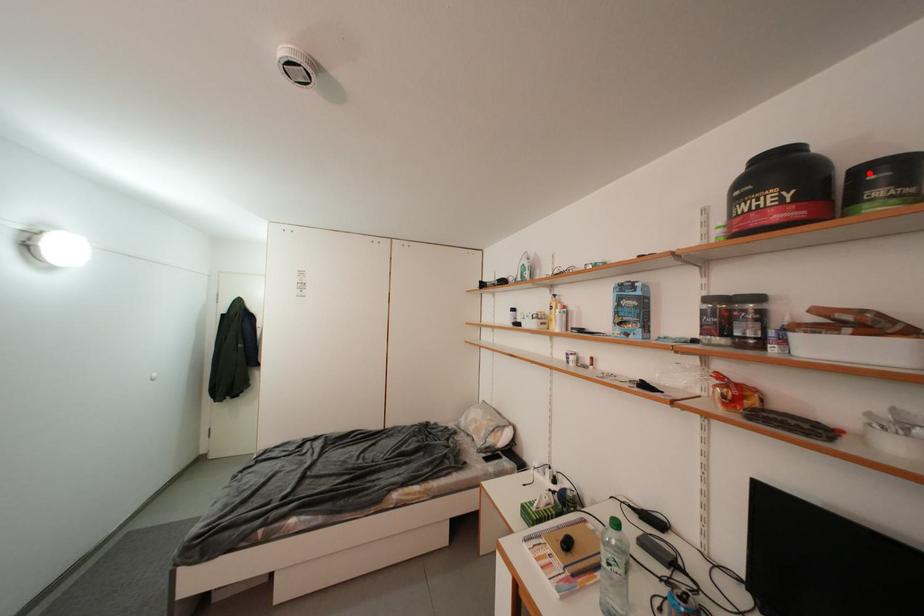
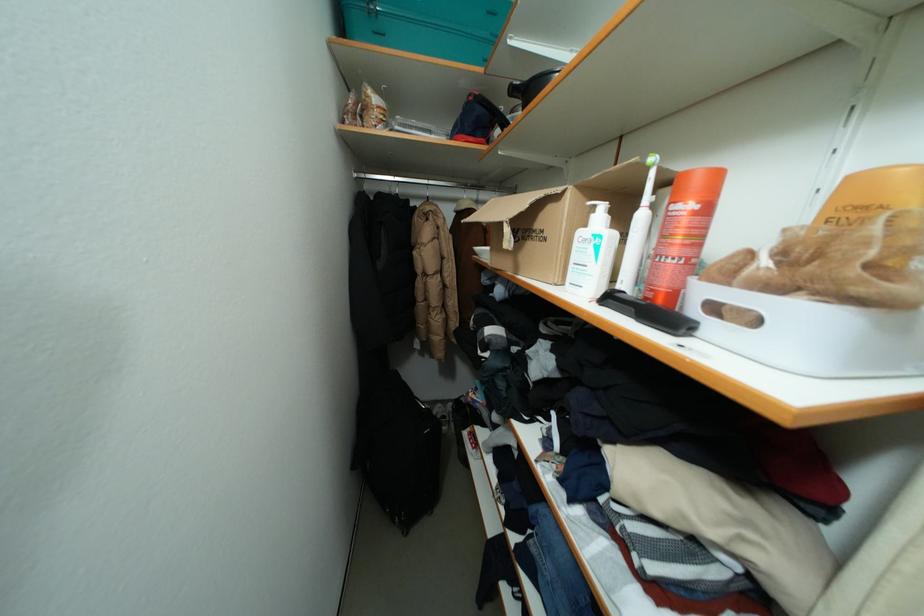
Question: I am providing you with two images of the same scene from different viewpoints. A red point is marked on the first image. At the location where the point appears in image 1, is it still visible in image 2?

Choices:
 (A) Yes
 (B) No

Answer: (B)